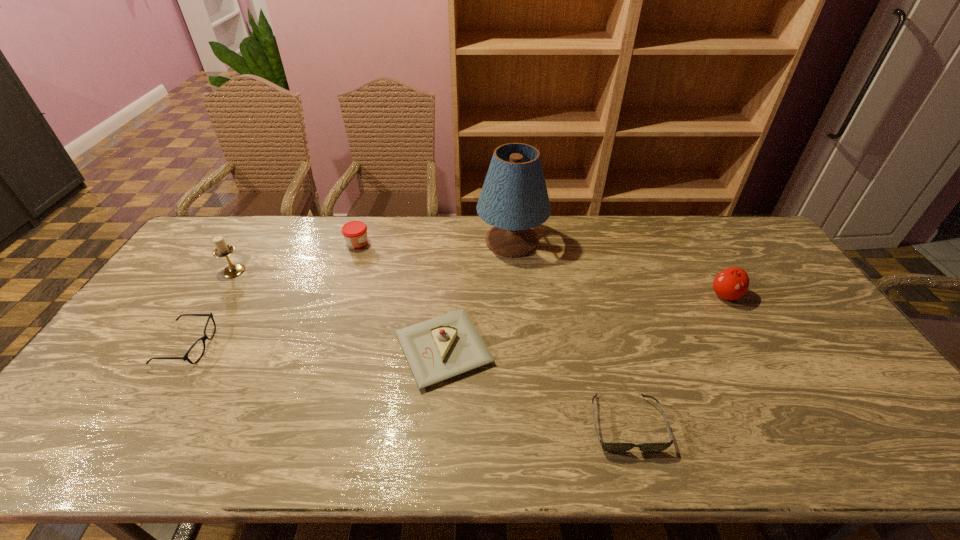
In the image, there is a desktop. Where is `vacant space at the far edge`? This screenshot has width=960, height=540. vacant space at the far edge is located at coordinates (697, 249).

Identify the location of vacant space at the near edge of the desktop. Image resolution: width=960 pixels, height=540 pixels. (189, 429).

Locate an element on the screen. The width and height of the screenshot is (960, 540). vacant area at the left edge is located at coordinates (186, 323).

In the image, there is a desktop. In order to click on vacant space at the right edge in this screenshot , I will do `click(805, 361)`.

Find the location of `free space at the far left corner`. free space at the far left corner is located at coordinates (202, 247).

In the image, there is a desktop. Where is `vacant space at the far right corner`? vacant space at the far right corner is located at coordinates (731, 239).

Where is `unoccupied area between the rightmost object and the candle holder`? The width and height of the screenshot is (960, 540). unoccupied area between the rightmost object and the candle holder is located at coordinates (479, 283).

Locate an element on the screen. free point between the lampshade and the shortest object is located at coordinates (568, 332).

Where is `free space between the apple and the lampshade`? free space between the apple and the lampshade is located at coordinates (618, 268).

This screenshot has height=540, width=960. Identify the location of free point between the lampshade and the cake. (478, 295).